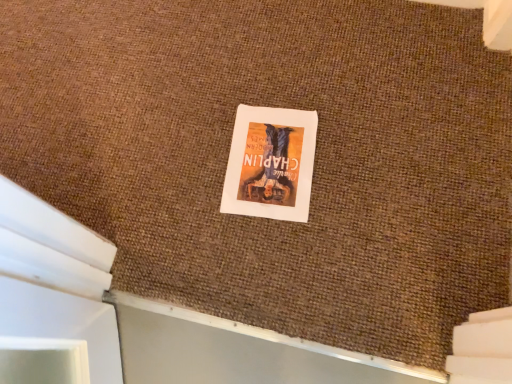
You are a GUI agent. You are given a task and a screenshot of the screen. Output one action in this format:
    pyautogui.click(x=<x>, y=<y>)
    Task: Click on the matte paper poster at center
    The width and height of the screenshot is (512, 384).
    Given the screenshot: What is the action you would take?
    pyautogui.click(x=270, y=163)

In order to face matte paper poster at center, should I rotate leftwards or rightwards?

Turn right approximately 2.057 degrees to face it.

The width and height of the screenshot is (512, 384). What do you see at coordinates (270, 163) in the screenshot?
I see `matte paper poster at center` at bounding box center [270, 163].

This screenshot has width=512, height=384. Identify the location of matte paper poster at center. (270, 163).